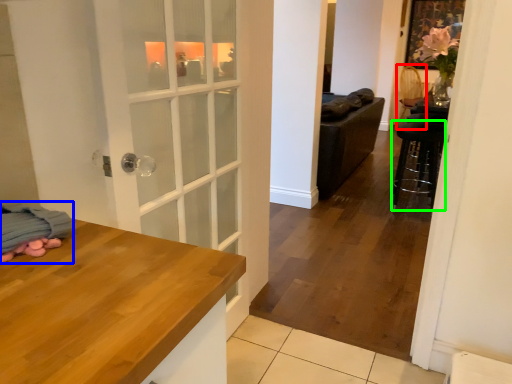
Question: Which object is positioned farthest from armchair (highlighted by a red box)? Select from blanket (highlighted by a blue box) and bar stool (highlighted by a green box).

Choices:
 (A) blanket
 (B) bar stool

Answer: (A)